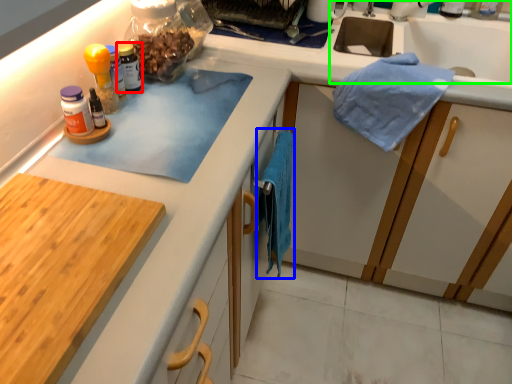
Question: Which object is the closest to the bottle (highlighted by a red box)? Choose among these: bath towel (highlighted by a blue box) or sink (highlighted by a green box).

Choices:
 (A) bath towel
 (B) sink

Answer: (A)